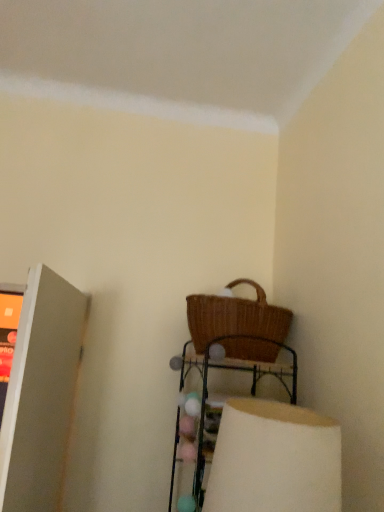
Question: Considering the relative positions of matte gray shelf at left and white matte lampshade at lower right in the image provided, is matte gray shelf at left to the left or to the right of white matte lampshade at lower right?

Choices:
 (A) right
 (B) left

Answer: (B)

Question: Is matte gray shelf at left spatially inside white matte lampshade at lower right, or outside of it?

Choices:
 (A) inside
 (B) outside

Answer: (B)

Question: Considering the real-world distances, which object is farthest from the woven wicker basket at upper center?

Choices:
 (A) white matte lampshade at lower right
 (B) woven brown picnic basket at lower right
 (C) matte gray shelf at left

Answer: (C)

Question: Based on their relative distances, which object is farther from the white matte lampshade at lower right?

Choices:
 (A) woven wicker basket at upper center
 (B) matte gray shelf at left
 (C) woven brown picnic basket at lower right

Answer: (B)